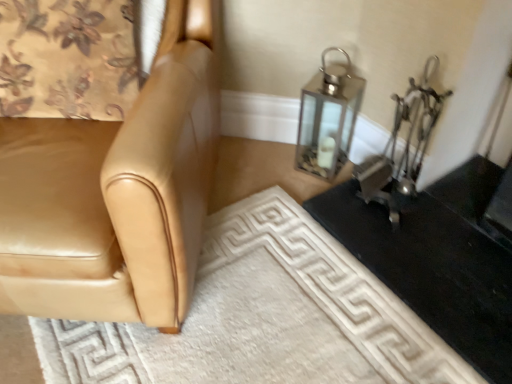
Question: In the image, is white textured doormat at lower center positioned in front of or behind tan leather chair at left?

Choices:
 (A) behind
 (B) front

Answer: (A)

Question: Is point (86, 352) closer or farther from the camera than point (195, 119)?

Choices:
 (A) farther
 (B) closer

Answer: (A)

Question: Which is nearer to the black glossy table at lower right?

Choices:
 (A) metallic lantern at upper right
 (B) tan leather chair at left
 (C) floral fabric curtain at upper left
 (D) white textured doormat at lower center

Answer: (D)

Question: Which object is positioned farthest from the floral fabric curtain at upper left?

Choices:
 (A) black glossy table at lower right
 (B) metallic lantern at upper right
 (C) tan leather chair at left
 (D) white textured doormat at lower center

Answer: (A)